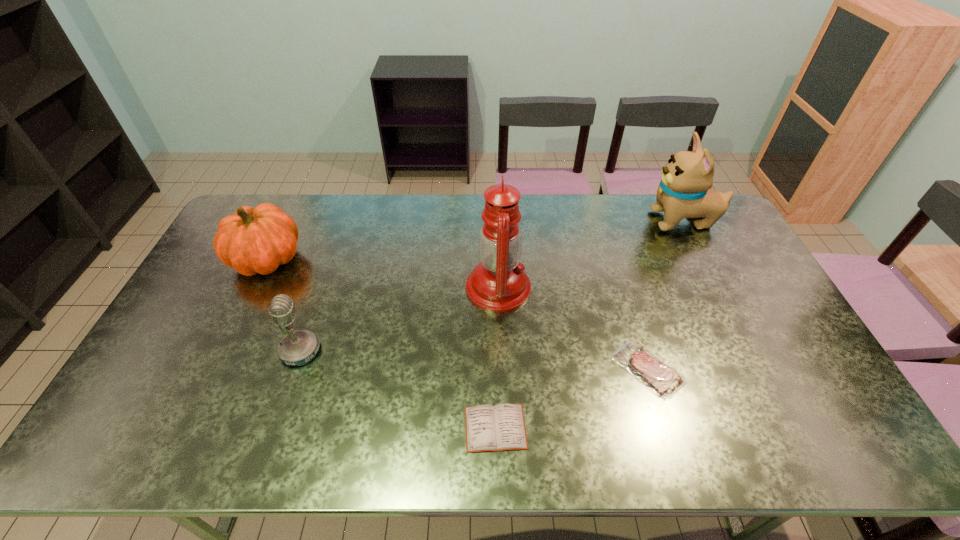
Locate an element on the screen. Image resolution: width=960 pixels, height=540 pixels. oil lamp is located at coordinates (498, 283).

This screenshot has height=540, width=960. In order to click on puppy in this screenshot , I will do tap(684, 191).

Identify the location of the rightmost object. (684, 191).

Image resolution: width=960 pixels, height=540 pixels. Find the location of `pumpkin`. pumpkin is located at coordinates (255, 240).

The height and width of the screenshot is (540, 960). In order to click on microphone in this screenshot , I will do `click(299, 347)`.

Locate an element on the screen. the fifth tallest object is located at coordinates [664, 381].

In order to click on steak in this screenshot , I will do `click(664, 381)`.

Identify the location of the shortest object. (500, 427).

Locate an element on the screen. The height and width of the screenshot is (540, 960). diary is located at coordinates (500, 427).

Locate an element on the screen. The height and width of the screenshot is (540, 960). vacant space located 0.130m on the back of the tallest object is located at coordinates (496, 237).